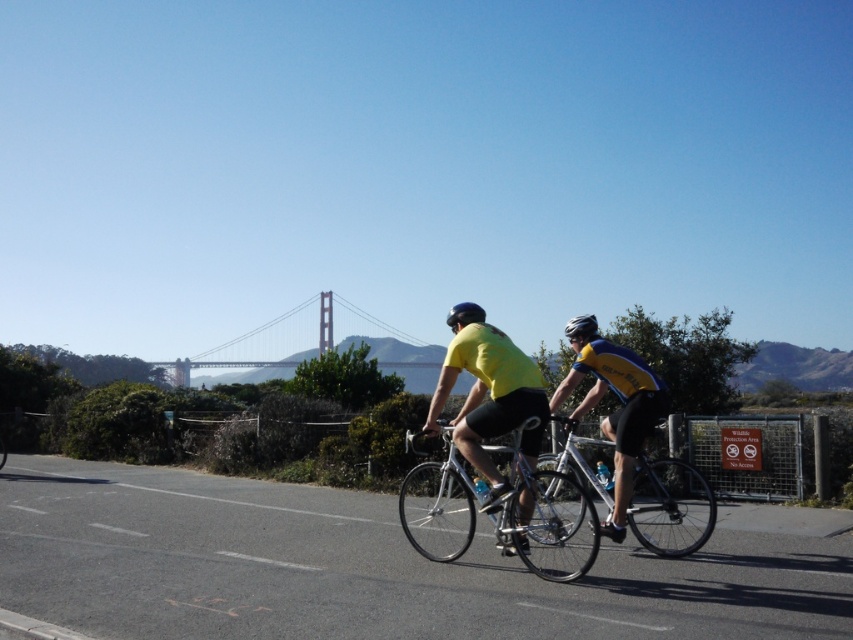
You are a photographer trying to capture a photo of the metallic gray bridge at center and the matte black helmet at center. Based on their positions, which object should you focus on first if you want to include both in your shot without moving the camera?

The metallic gray bridge at center is positioned on the left side of the matte black helmet at center. To include both in the shot without moving the camera, focus on the matte black helmet at center first as it is closer to the camera, allowing the bridge to be captured in the background.

You are a photographer standing at the point marked as point (x=547, y=520). You want to capture a photo of the shiny silver bicycle at center. Is the shiny silver bicycle at center within your field of view?

The point (x=547, y=520) corresponds to the shiny silver bicycle at center, so yes, the shiny silver bicycle at center is directly at your current position. However, since you are standing at the point that corresponds to the bicycle, you would need to adjust your camera angle or move slightly to frame the bicycle properly in your photo.